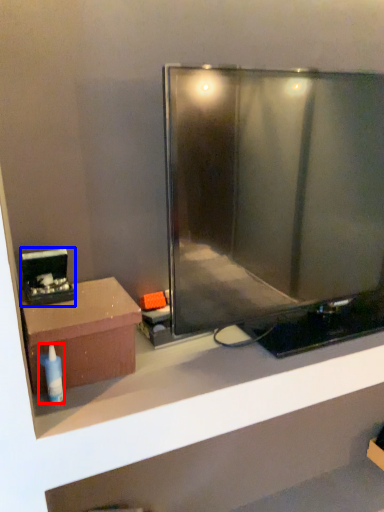
Question: Which point is further to the camera, toiletry (highlighted by a red box) or appliance (highlighted by a blue box)?

Choices:
 (A) toiletry
 (B) appliance

Answer: (B)